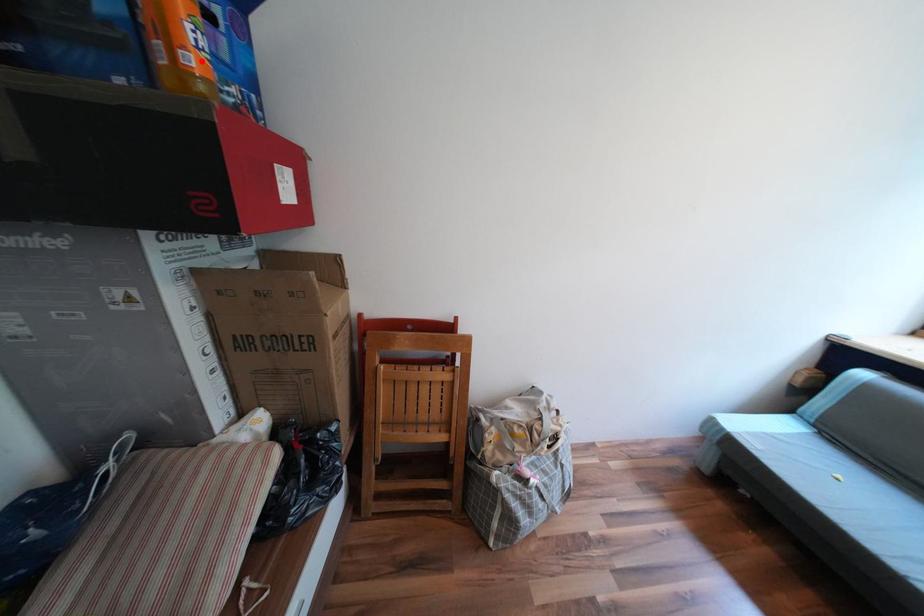
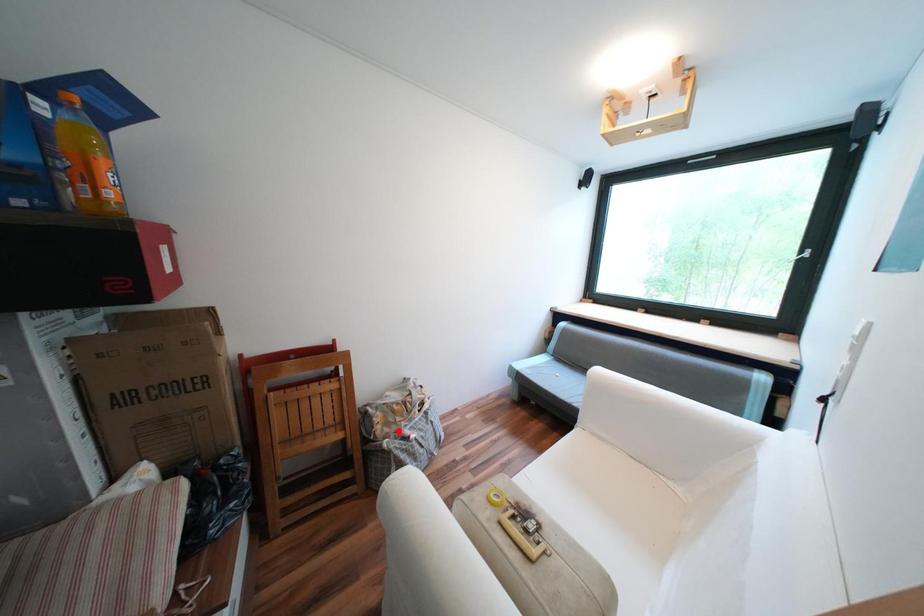
I am providing you with two images of the same scene from different viewpoints. A red point is marked on the first image and another point is marked on the second image. Is the marked point in image1 the same physical position as the marked point in image2?

No